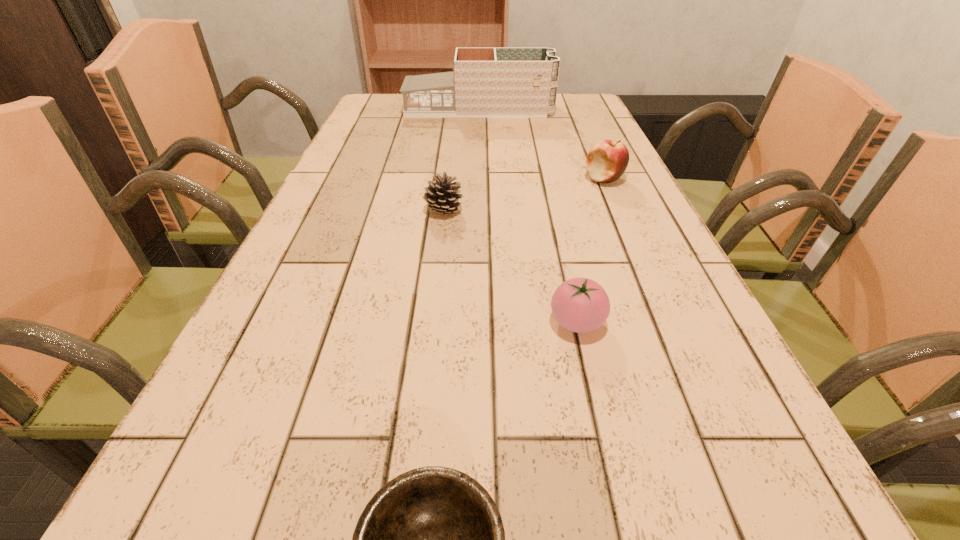
I want to click on vacant area that lies between the pinecone and the apple, so click(x=524, y=195).

You are a GUI agent. You are given a task and a screenshot of the screen. Output one action in this format:
    pyautogui.click(x=<x>, y=<y>)
    Task: Click on the free space between the apple and the farthest object
    This screenshot has width=960, height=540.
    Given the screenshot: What is the action you would take?
    pyautogui.click(x=541, y=144)

This screenshot has height=540, width=960. Identify the location of blank region between the apple and the pinecone. (524, 195).

Image resolution: width=960 pixels, height=540 pixels. In order to click on vacant space that's between the farthest object and the apple in this screenshot , I will do `click(541, 144)`.

I want to click on empty space that is in between the third farthest object and the fourth nearest object, so click(x=524, y=195).

Where is `object that is the second closest to the tallest object`? Image resolution: width=960 pixels, height=540 pixels. object that is the second closest to the tallest object is located at coordinates (442, 196).

Where is `object that is the closest to the dollhouse`? This screenshot has width=960, height=540. object that is the closest to the dollhouse is located at coordinates (607, 160).

Locate an element on the screen. Image resolution: width=960 pixels, height=540 pixels. vacant region that satisfies the following two spatial constraints: 1. at the entrance of the farthest object; 2. on the back side of the fourth farthest object is located at coordinates (478, 322).

The height and width of the screenshot is (540, 960). Find the location of `vacant space that satisfies the following two spatial constraints: 1. at the entrance of the tallest object; 2. on the right side of the second nearest object`. vacant space that satisfies the following two spatial constraints: 1. at the entrance of the tallest object; 2. on the right side of the second nearest object is located at coordinates (478, 322).

You are a GUI agent. You are given a task and a screenshot of the screen. Output one action in this format:
    pyautogui.click(x=<x>, y=<y>)
    Task: Click on the free point that satisfies the following two spatial constraints: 1. at the entrance of the farthest object; 2. on the front side of the third farthest object
    
    Given the screenshot: What is the action you would take?
    pyautogui.click(x=478, y=211)